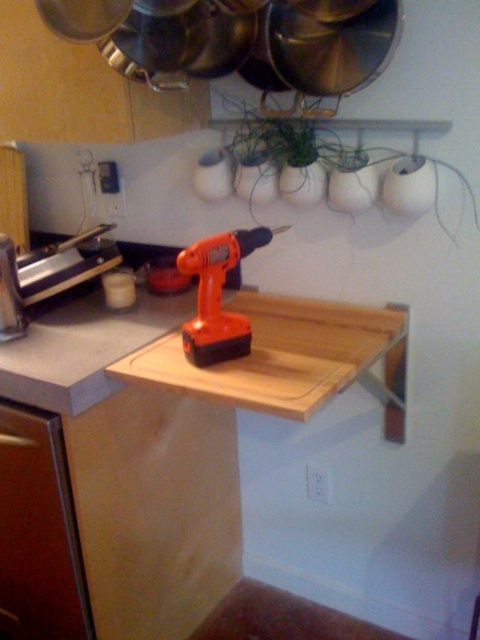
Please look at the kitchen scene. There is a point marked at coordinates (x=253, y=362). What object is located at that point?

The point at coordinates (x=253, y=362) indicates the wooden cutting board at center.

You are standing in front of the kitchen wall with the wooden shelf. There are two points marked on the wall at coordinates point (288, 296) and point (255, 240). Which point is closer to you?

Point (288, 296) is closer to you because it is further to the viewer than point (255, 240).